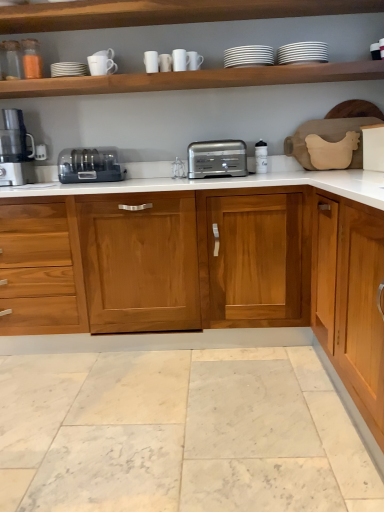
Find the location of a particular element. The width and height of the screenshot is (384, 512). empty space that is ontop of white marble floor at lower center is located at coordinates (152, 399).